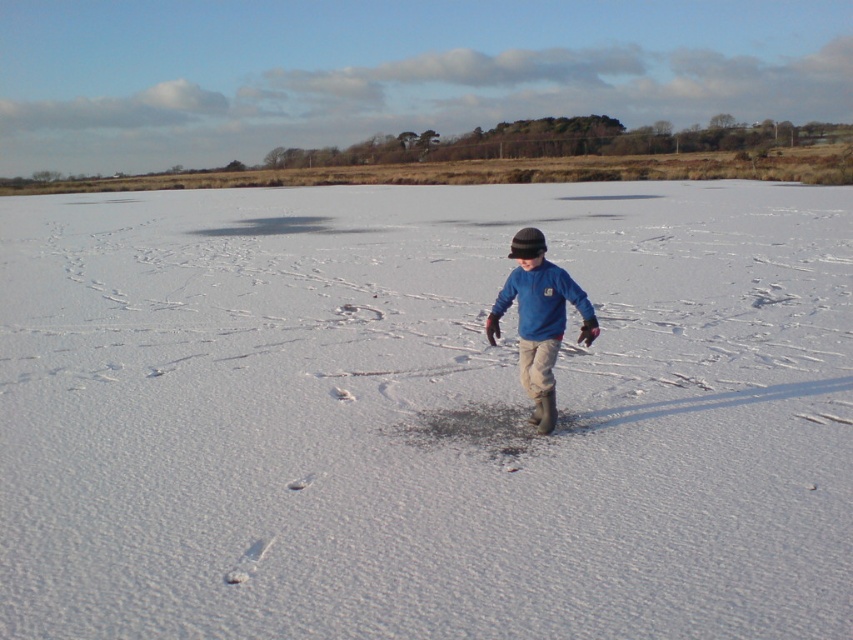
You are standing in the winter field and want to walk to the point marked as point (26, 563). Which direction should you head relative to point (585, 333)?

Since point (26, 563) is closer to the camera than point (585, 333), you should head towards the direction of point (26, 563) which is closer to you compared to point (585, 333).

The child in the winter scene is wearing a blue fleece jacket at center and a blue fleece at center. Which item is positioned lower on the child?

The blue fleece at center is positioned lower than the blue fleece jacket at center.